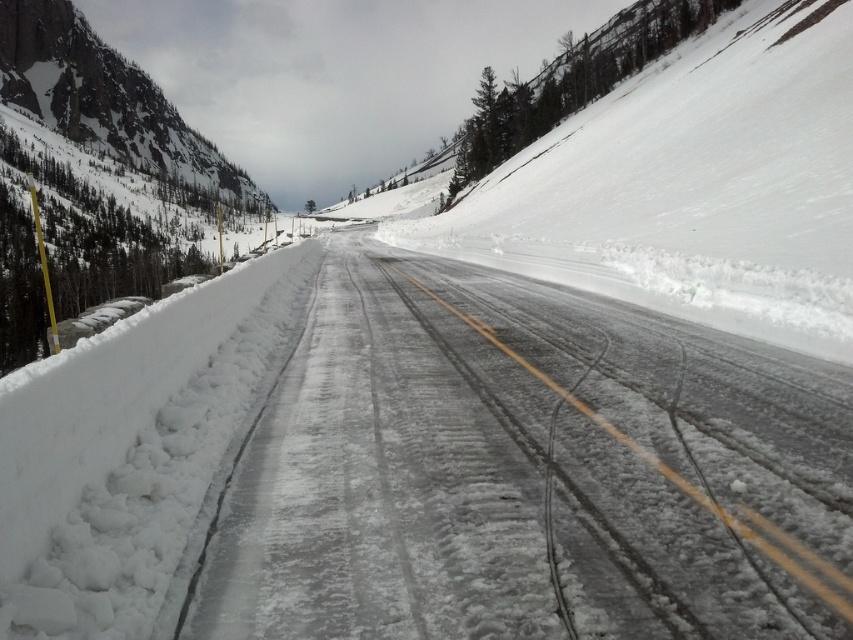
Does snowy asphalt road at center appear on the left side of snowy rock cliff at upper left?

No, snowy asphalt road at center is not to the left of snowy rock cliff at upper left.

Identify the location of snowy asphalt road at center. This screenshot has height=640, width=853. (531, 472).

You are a GUI agent. You are given a task and a screenshot of the screen. Output one action in this format:
    pyautogui.click(x=<x>, y=<y>)
    Task: Click on the snowy asphalt road at center
    Image resolution: width=853 pixels, height=640 pixels.
    Given the screenshot: What is the action you would take?
    pyautogui.click(x=531, y=472)